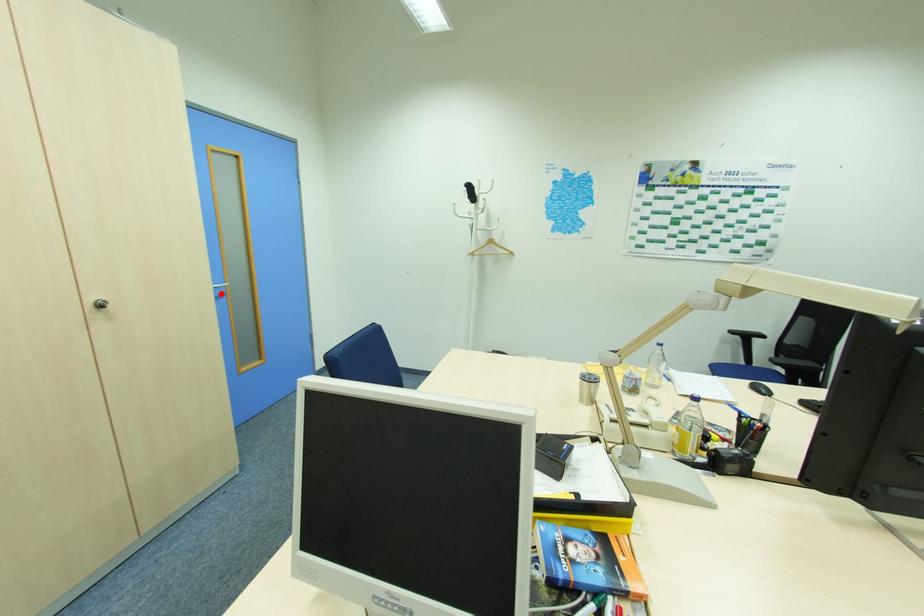
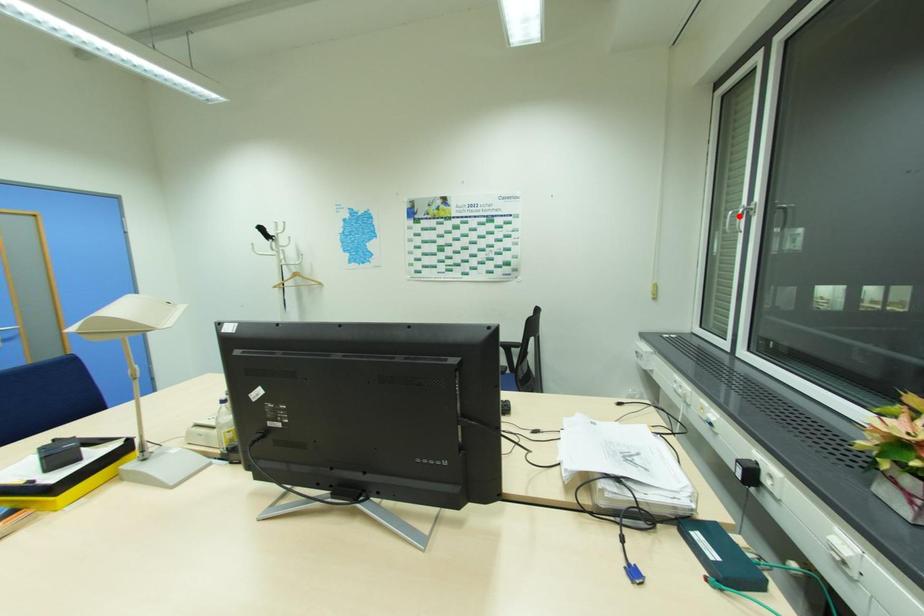
I am providing you with two images of the same scene from different viewpoints. A red point is marked on the first image and another point is marked on the second image. Is the red point in image1 aligned with the point shown in image2?

No